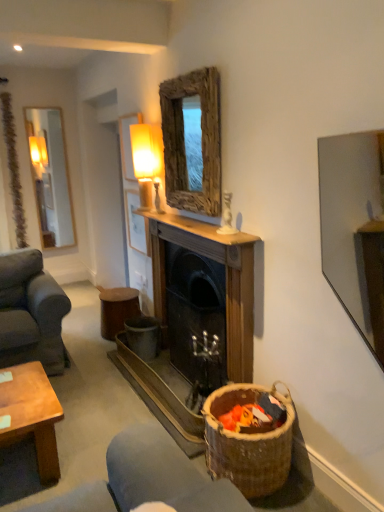
Question: Is wooden fireplace at center far away from brown woven basket at lower right?

Choices:
 (A) no
 (B) yes

Answer: (A)

Question: Is wooden fireplace at center bigger than brown woven basket at lower right?

Choices:
 (A) no
 (B) yes

Answer: (B)

Question: Can we say wooden fireplace at center lies outside brown woven basket at lower right?

Choices:
 (A) no
 (B) yes

Answer: (B)

Question: Considering the relative sizes of wooden fireplace at center and brown woven basket at lower right in the image provided, is wooden fireplace at center taller than brown woven basket at lower right?

Choices:
 (A) no
 (B) yes

Answer: (B)

Question: Is wooden fireplace at center shorter than brown woven basket at lower right?

Choices:
 (A) yes
 (B) no

Answer: (B)

Question: Is wooden fireplace at center surrounding brown woven basket at lower right?

Choices:
 (A) yes
 (B) no

Answer: (B)

Question: Can you confirm if rustic wood mirror at upper center is smaller than brown woven basket at lower right?

Choices:
 (A) yes
 (B) no

Answer: (A)

Question: Considering the relative sizes of rustic wood mirror at upper center and brown woven basket at lower right in the image provided, is rustic wood mirror at upper center wider than brown woven basket at lower right?

Choices:
 (A) no
 (B) yes

Answer: (A)

Question: Can you confirm if rustic wood mirror at upper center is bigger than brown woven basket at lower right?

Choices:
 (A) yes
 (B) no

Answer: (B)

Question: From the image's perspective, is rustic wood mirror at upper center beneath brown woven basket at lower right?

Choices:
 (A) yes
 (B) no

Answer: (B)

Question: Does rustic wood mirror at upper center come behind brown woven basket at lower right?

Choices:
 (A) no
 (B) yes

Answer: (B)

Question: Is rustic wood mirror at upper center outside of brown woven basket at lower right?

Choices:
 (A) yes
 (B) no

Answer: (A)

Question: Can you confirm if wooden fireplace at center is thinner than wooden stool at center?

Choices:
 (A) yes
 (B) no

Answer: (A)